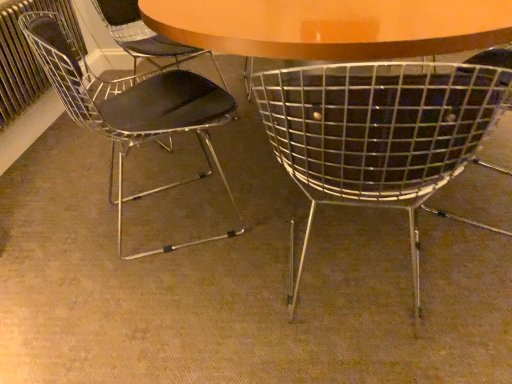
At what (x,y) coordinates should I click in order to perform the action: click on vacant area that lies between metal mesh chair at center, which is the second chair in left-to-right order, and metallic wire chair at left, the 1th chair from the left. Please return your answer as a coordinate pair (x, y). Image resolution: width=512 pixels, height=384 pixels. Looking at the image, I should click on (245, 246).